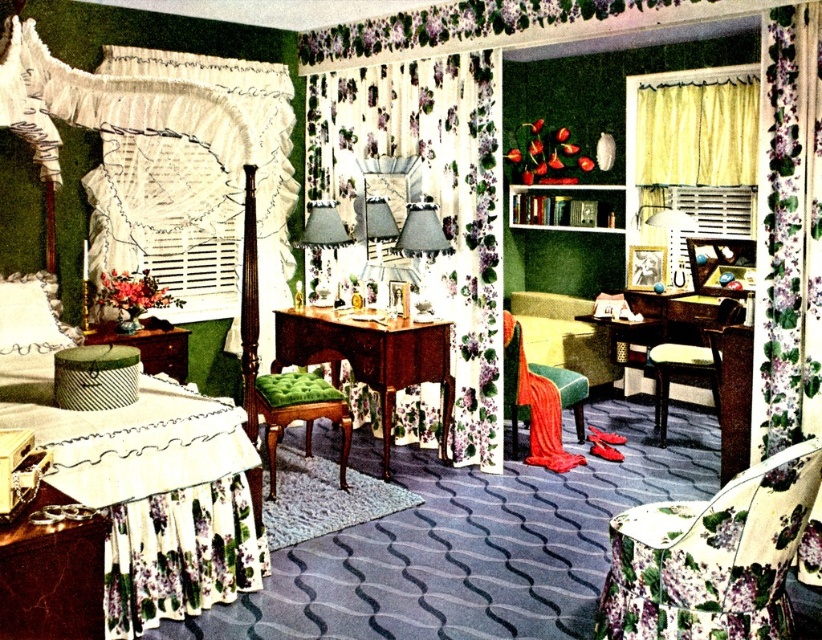
Question: Which object is farther from the camera taking this photo?

Choices:
 (A) floral fabric armchair at lower right
 (B) white fabric pillow at lower left
 (C) white floral fabric bed at left

Answer: (B)

Question: Which is nearer to the velvet green armchair at center?

Choices:
 (A) white fabric pillow at lower left
 (B) floral fabric curtain at center

Answer: (B)

Question: Does wooden table with green cushion at center appear over wooden armchair at center?

Choices:
 (A) yes
 (B) no

Answer: (A)

Question: Can you confirm if wooden table with green cushion at center is smaller than wooden armchair at center?

Choices:
 (A) yes
 (B) no

Answer: (B)

Question: Does white fabric pillow at lower left lie behind green fabric ottoman at lower left?

Choices:
 (A) yes
 (B) no

Answer: (B)

Question: Which of the following is the farthest from the observer?

Choices:
 (A) green tufted fabric stool at center
 (B) velvet green armchair at center
 (C) wooden table with green cushion at center
 (D) yellow sheer curtain at upper right

Answer: (D)